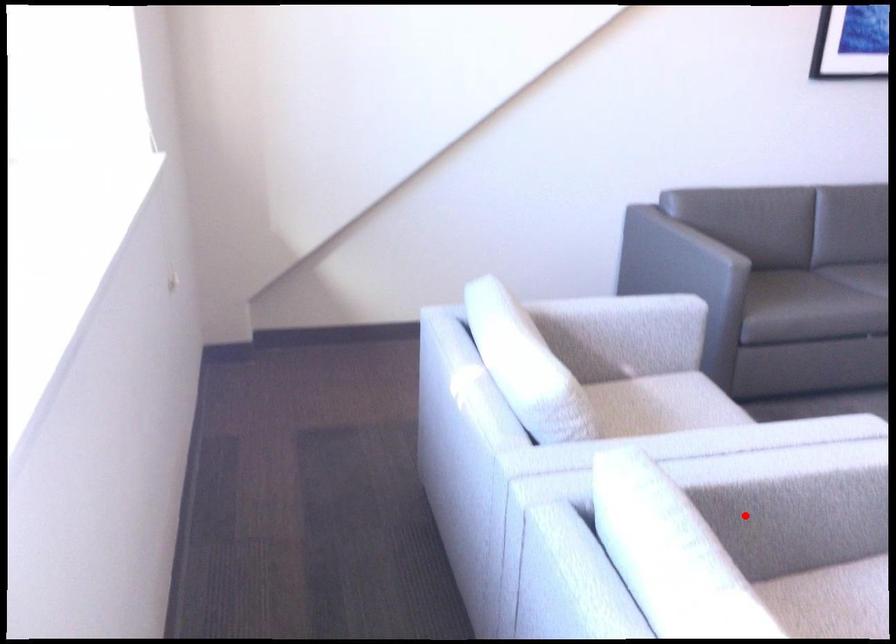
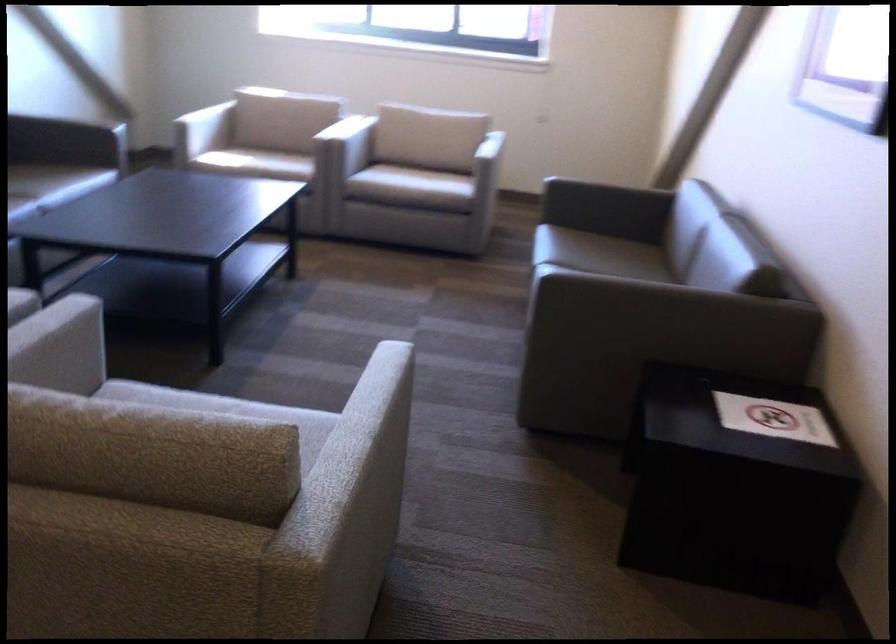
The point at the highlighted location is marked in the first image. Where is the corresponding point in the second image?

(347, 145)